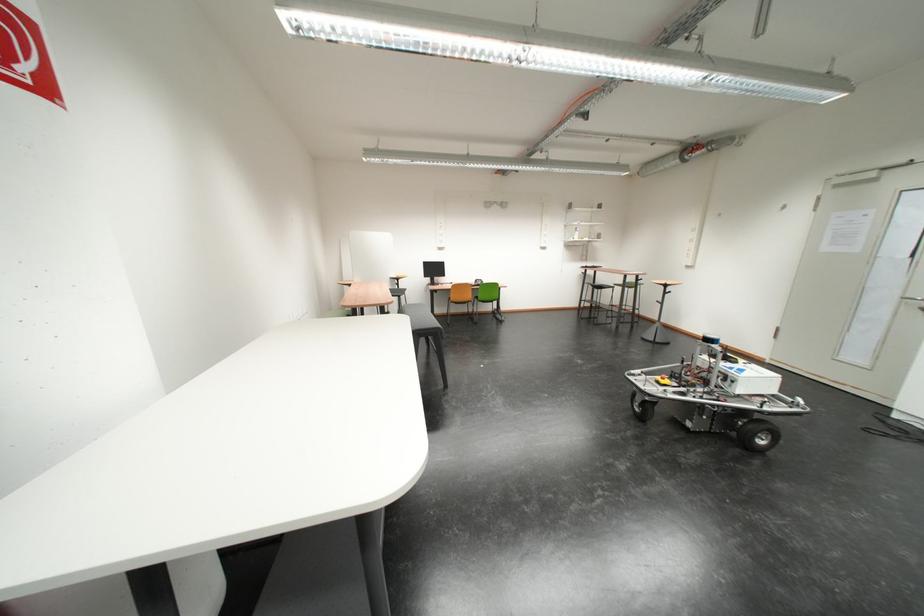
The width and height of the screenshot is (924, 616). Identify the location of black stool sitting surface. (600, 290).